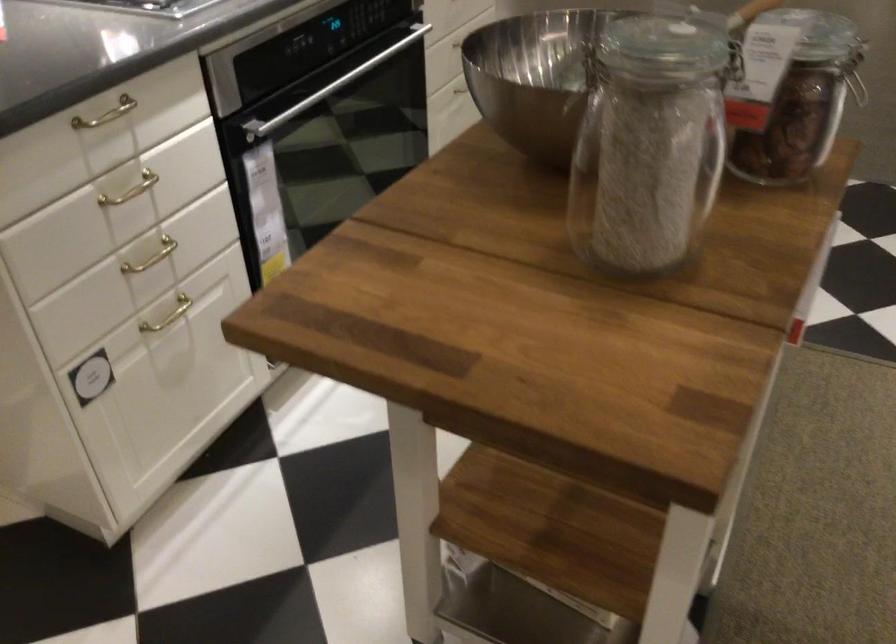
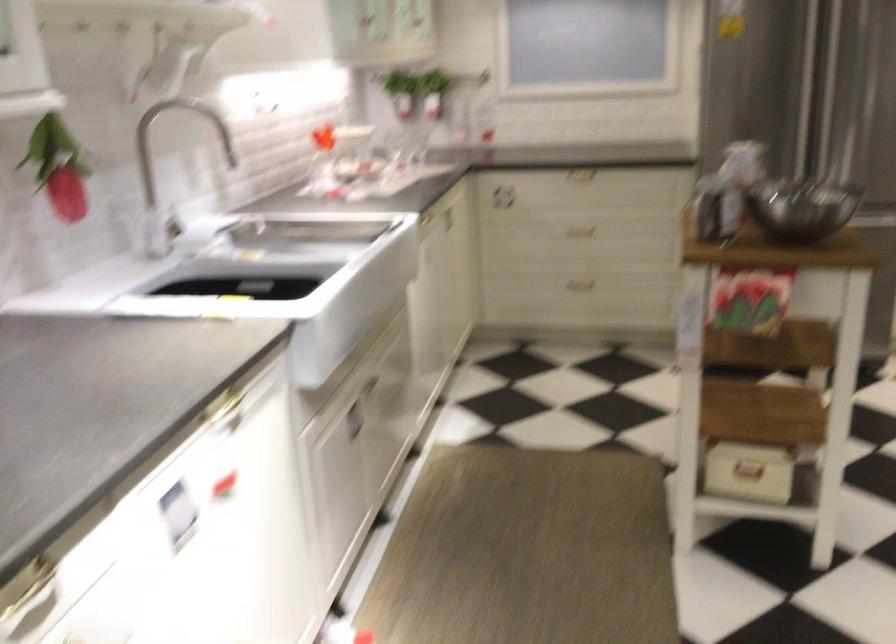
Locate, in the second image, the point that corresponds to [662,48] in the first image.

(729, 138)